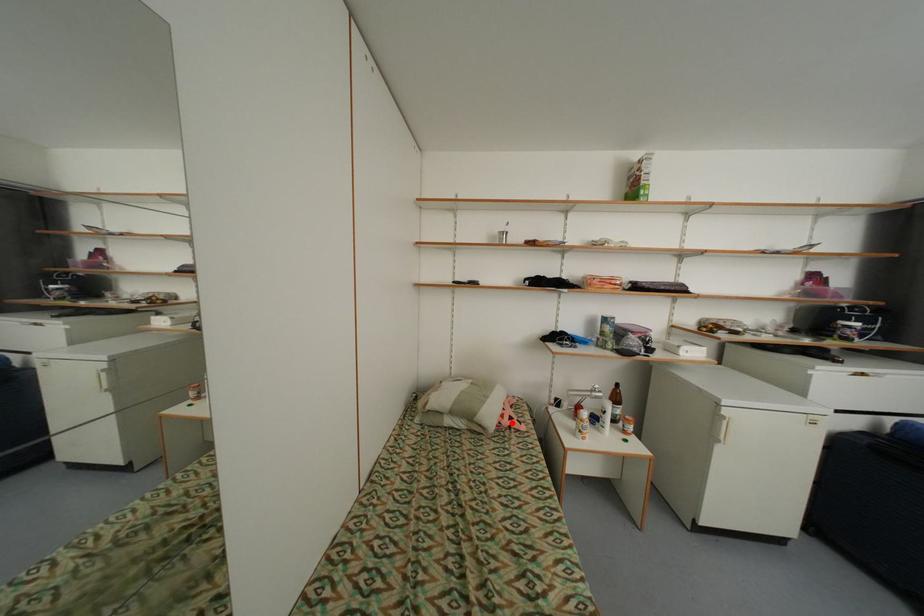
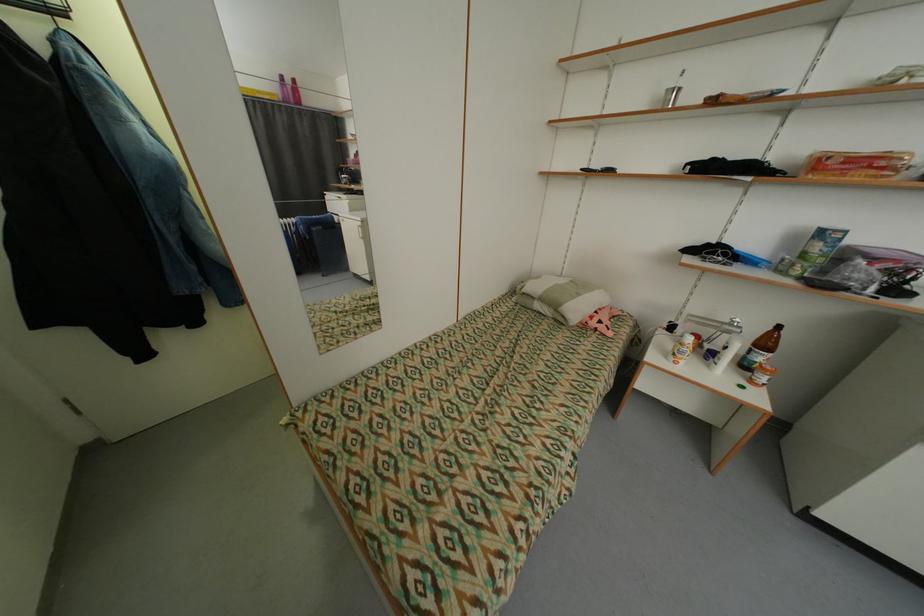
Where in the second image is the point corresponding to the highlighted location from the first image?

(600, 323)